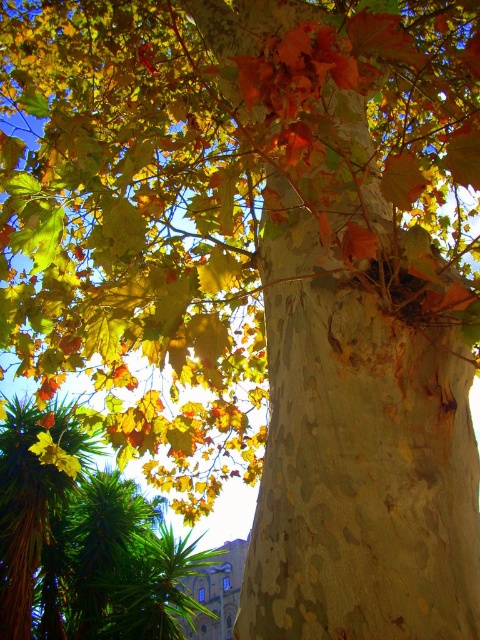
Question: Which point appears farthest from the camera in this image?

Choices:
 (A) (58, 636)
 (B) (27, 513)

Answer: (A)

Question: Does green leafy palm at lower left come behind green leafy palm at upper left?

Choices:
 (A) yes
 (B) no

Answer: (A)

Question: Is green leafy palm at lower left to the left of green leafy palm at upper left from the viewer's perspective?

Choices:
 (A) no
 (B) yes

Answer: (A)

Question: Among these points, which one is nearest to the camera?

Choices:
 (A) (19, 452)
 (B) (119, 516)

Answer: (A)

Question: Is green leafy palm at lower left in front of green leafy palm at upper left?

Choices:
 (A) no
 (B) yes

Answer: (A)